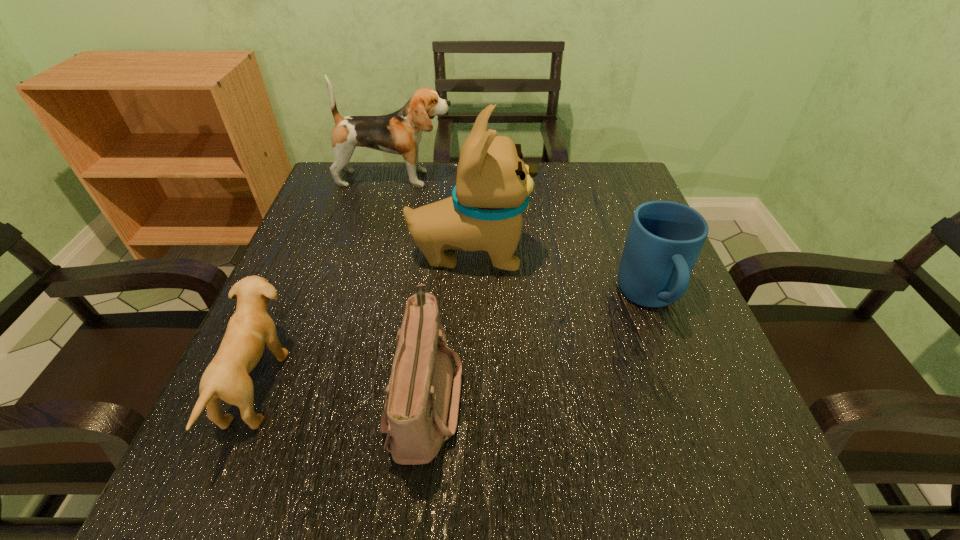
Find the location of a particular element. the second farthest puppy is located at coordinates (493, 185).

Locate an element on the screen. This screenshot has height=540, width=960. the second tallest puppy is located at coordinates (400, 133).

Where is `the farthest object`? This screenshot has height=540, width=960. the farthest object is located at coordinates (400, 133).

What are the coordinates of `mug` in the screenshot? It's located at (665, 238).

Where is `the nearest puppy`? the nearest puppy is located at coordinates (250, 328).

Locate an element on the screen. Image resolution: width=960 pixels, height=540 pixels. shoulder bag is located at coordinates (421, 408).

Where is `vacant region located on the face of the second farthest puppy`? This screenshot has width=960, height=540. vacant region located on the face of the second farthest puppy is located at coordinates (636, 253).

You are a GUI agent. You are given a task and a screenshot of the screen. Output one action in this format:
    pyautogui.click(x=<x>, y=<y>)
    Task: Click on the vacant space located at the face of the farthest object
    
    Given the screenshot: What is the action you would take?
    pyautogui.click(x=602, y=179)

Identify the location of vacant space located 0.170m on the side of the mug with the handle. (698, 422).

Locate an element on the screen. The height and width of the screenshot is (540, 960). vacant area situated on the left side of the nearest puppy is located at coordinates (472, 386).